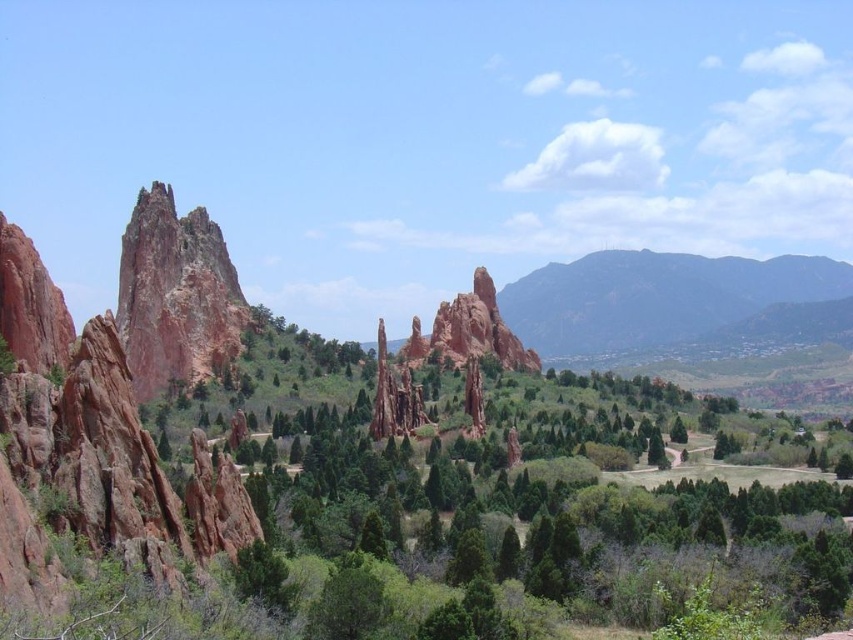
Question: Can you confirm if dark gray rocky mountain at right is thinner than rustic sandstone spire at center?

Choices:
 (A) no
 (B) yes

Answer: (A)

Question: Does dark gray rocky mountain at right lie in front of rustic sandstone spire at center?

Choices:
 (A) yes
 (B) no

Answer: (B)

Question: Can you confirm if dark gray rocky mountain at right is positioned above rustic sandstone spire at center?

Choices:
 (A) yes
 (B) no

Answer: (A)

Question: Which point is closer to the camera taking this photo?

Choices:
 (A) (618, 268)
 (B) (415, 396)

Answer: (B)

Question: Which point is farther to the camera?

Choices:
 (A) rustic sandstone spire at center
 (B) dark gray rocky mountain at right

Answer: (B)

Question: Which object is closer to the camera taking this photo?

Choices:
 (A) rustic sandstone spire at center
 (B) dark gray rocky mountain at right

Answer: (A)